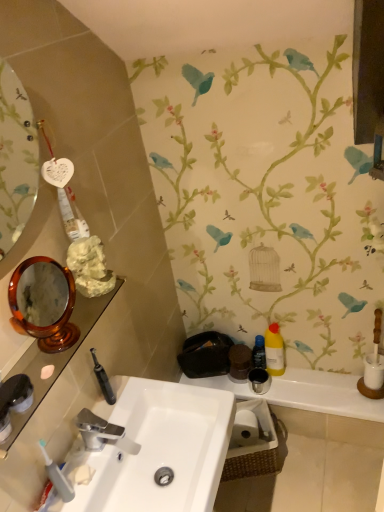
You are a GUI agent. You are given a task and a screenshot of the screen. Output one action in this format:
    pyautogui.click(x=<x>, y=<y>)
    Task: Click on the vacant space behind silver metallic faucet at center
    This screenshot has width=384, height=512.
    Given the screenshot: What is the action you would take?
    pyautogui.click(x=125, y=403)